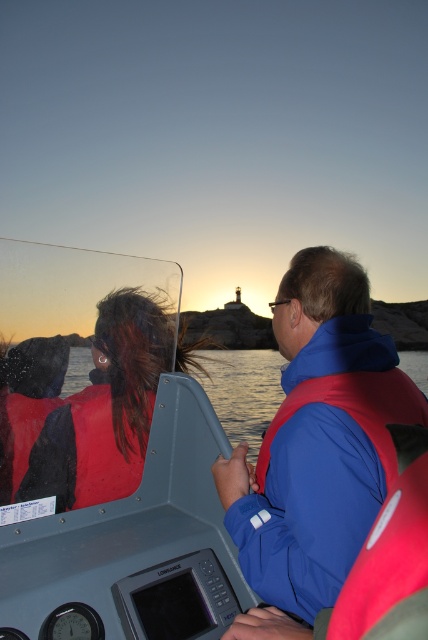
Question: Which point is farther to the camera?

Choices:
 (A) transparent water at center
 (B) matte red life vest at left
 (C) blue fabric life vest at right
 (D) rubberized red life vest at center

Answer: (A)

Question: From the image, what is the correct spatial relationship of rubberized red life vest at center in relation to matte red life vest at left?

Choices:
 (A) left
 (B) right

Answer: (B)

Question: Does blue fabric life vest at right have a larger size compared to matte red life vest at left?

Choices:
 (A) no
 (B) yes

Answer: (B)

Question: Estimate the real-world distances between objects in this image. Which object is farther from the matte red life vest at left?

Choices:
 (A) transparent water at center
 (B) rubberized red life vest at center

Answer: (A)

Question: Observing the image, what is the correct spatial positioning of blue fabric life vest at right in reference to matte red life vest at left?

Choices:
 (A) below
 (B) above

Answer: (A)

Question: Which object appears farthest from the camera in this image?

Choices:
 (A) rubberized red life vest at center
 (B) transparent water at center
 (C) blue fabric life vest at right

Answer: (B)